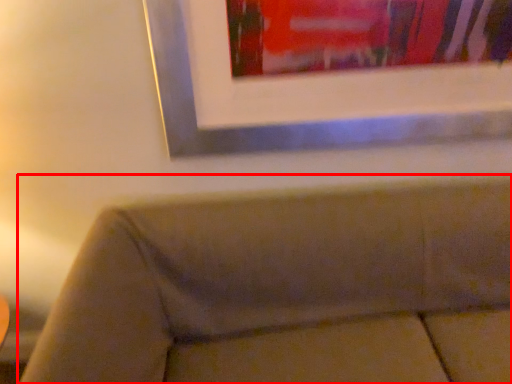
Question: From the image's perspective, what is the correct spatial positioning of studio couch (annotated by the red box) in reference to picture frame?

Choices:
 (A) below
 (B) above

Answer: (A)